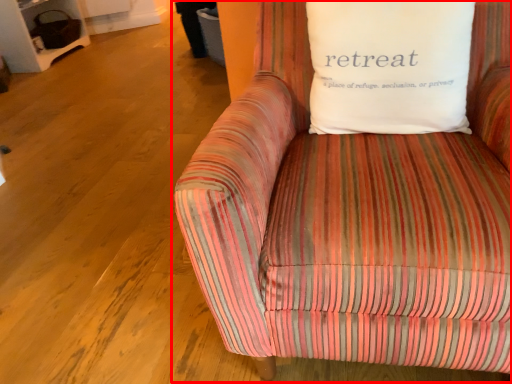
Question: Observing the image, what is the correct spatial positioning of studio couch (annotated by the red box) in reference to pillow?

Choices:
 (A) left
 (B) right

Answer: (B)